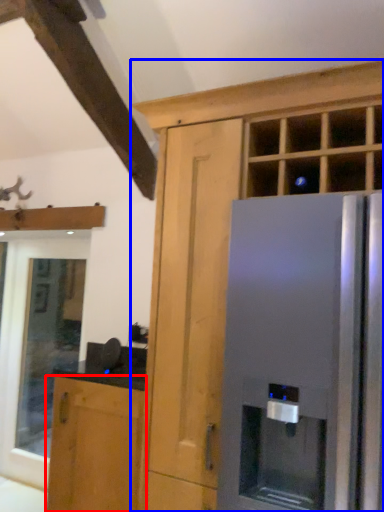
Question: Which object is closer to the camera taking this photo, cabinetry (highlighted by a red box) or cabinetry (highlighted by a blue box)?

Choices:
 (A) cabinetry
 (B) cabinetry

Answer: (B)